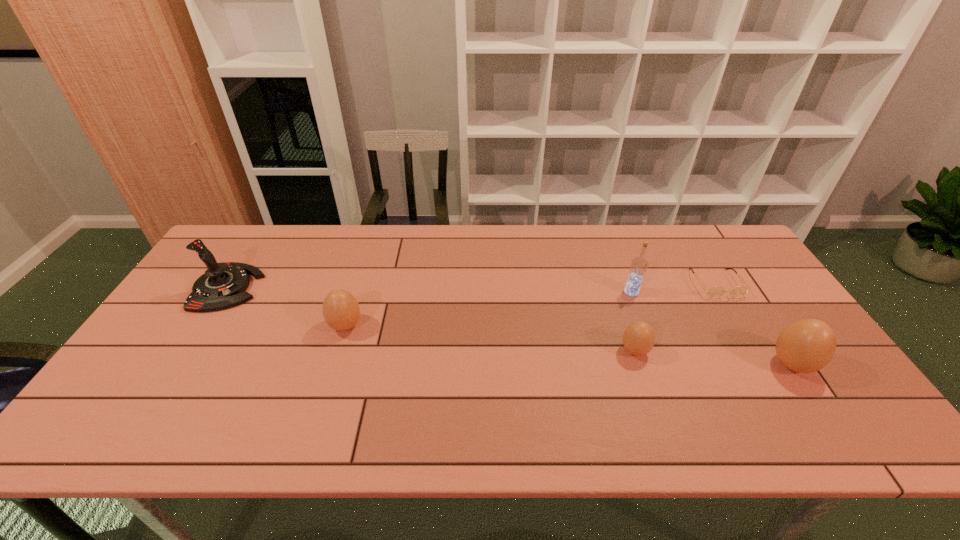
To make them evenly spaced by inserting another boiled_egg among them, please locate a vacant spot for this new boiled_egg. Please provide its 2D coordinates. Your answer should be formatted as a tuple, i.e. [(x, y)], where the tuple contains the x and y coordinates of a point satisfying the conditions above.

[(486, 338)]